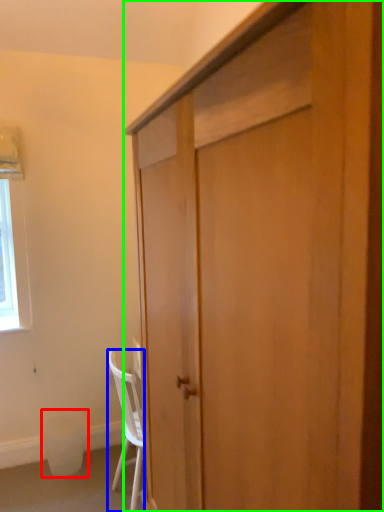
Question: Which object is the farthest from trash bin/can (highlighted by a red box)? Choose among these: chair (highlighted by a blue box) or cabinetry (highlighted by a green box).

Choices:
 (A) chair
 (B) cabinetry

Answer: (B)